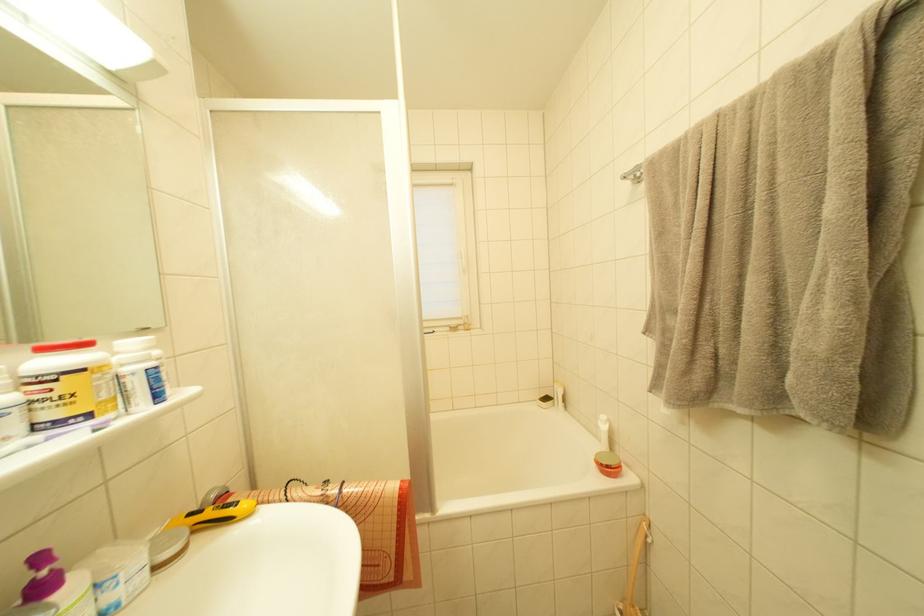
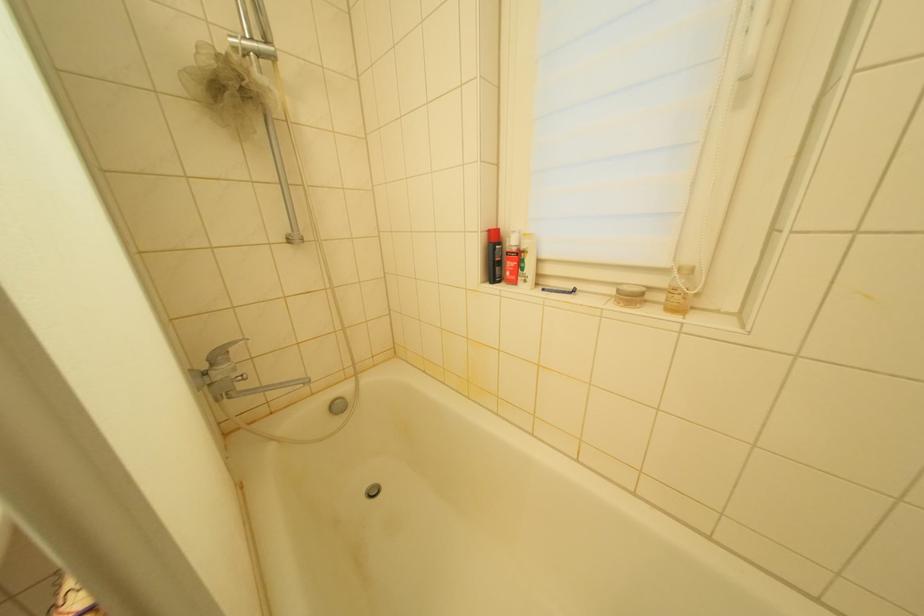
In the second image, find the point that corresponds to point 455,331 in the first image.

(623, 294)